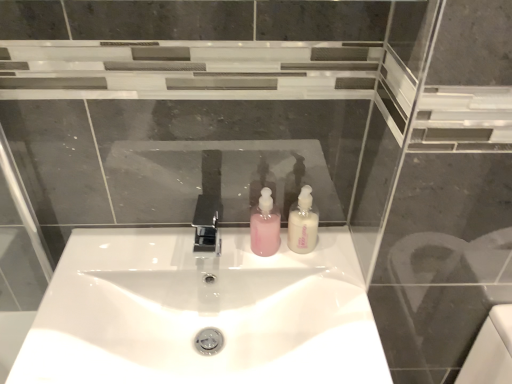
Locate an element on the screen. free spot in front of pink matte soap dispenser at center, the second soap dispenser when ordered from right to left is located at coordinates (301, 297).